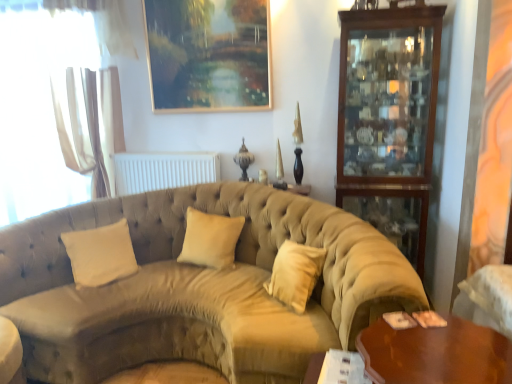
Question: Are beige fabric pillow at center, the 2th pillow viewed from the left, and white sheer curtain at left far apart?

Choices:
 (A) yes
 (B) no

Answer: (A)

Question: Considering the relative positions of beige fabric pillow at center, the 1th pillow from the right, and white sheer curtain at left in the image provided, is beige fabric pillow at center, the 1th pillow from the right, to the left of white sheer curtain at left from the viewer's perspective?

Choices:
 (A) no
 (B) yes

Answer: (A)

Question: Is beige fabric pillow at center, the 1th pillow from the right, behind white sheer curtain at left?

Choices:
 (A) no
 (B) yes

Answer: (A)

Question: Could you tell me if beige fabric pillow at center, the 1th pillow from the right, is facing white sheer curtain at left?

Choices:
 (A) no
 (B) yes

Answer: (A)

Question: Can you confirm if beige fabric pillow at center, the 2th pillow viewed from the left, is taller than white sheer curtain at left?

Choices:
 (A) yes
 (B) no

Answer: (B)

Question: Can you confirm if beige fabric pillow at center, the 1th pillow from the right, is bigger than white sheer curtain at left?

Choices:
 (A) yes
 (B) no

Answer: (B)

Question: Is white velvet pillow at center, the 2th pillow viewed from the right, located outside velvet beige couch at center?

Choices:
 (A) yes
 (B) no

Answer: (B)

Question: Is velvet beige couch at center inside white velvet pillow at center, arranged as the first pillow when viewed from the left?

Choices:
 (A) no
 (B) yes

Answer: (A)

Question: From the image's perspective, would you say white velvet pillow at center, arranged as the first pillow when viewed from the left, is positioned over velvet beige couch at center?

Choices:
 (A) yes
 (B) no

Answer: (A)

Question: Does white velvet pillow at center, the 2th pillow viewed from the right, have a lesser height compared to velvet beige couch at center?

Choices:
 (A) no
 (B) yes

Answer: (B)

Question: Can you confirm if white velvet pillow at center, arranged as the first pillow when viewed from the left, is wider than velvet beige couch at center?

Choices:
 (A) no
 (B) yes

Answer: (A)

Question: From a real-world perspective, is white velvet pillow at center, the 2th pillow viewed from the right, positioned under velvet beige couch at center based on gravity?

Choices:
 (A) no
 (B) yes

Answer: (A)

Question: Is white matte radiator at center positioned beyond the bounds of mahogany wood cabinet at right?

Choices:
 (A) yes
 (B) no

Answer: (A)